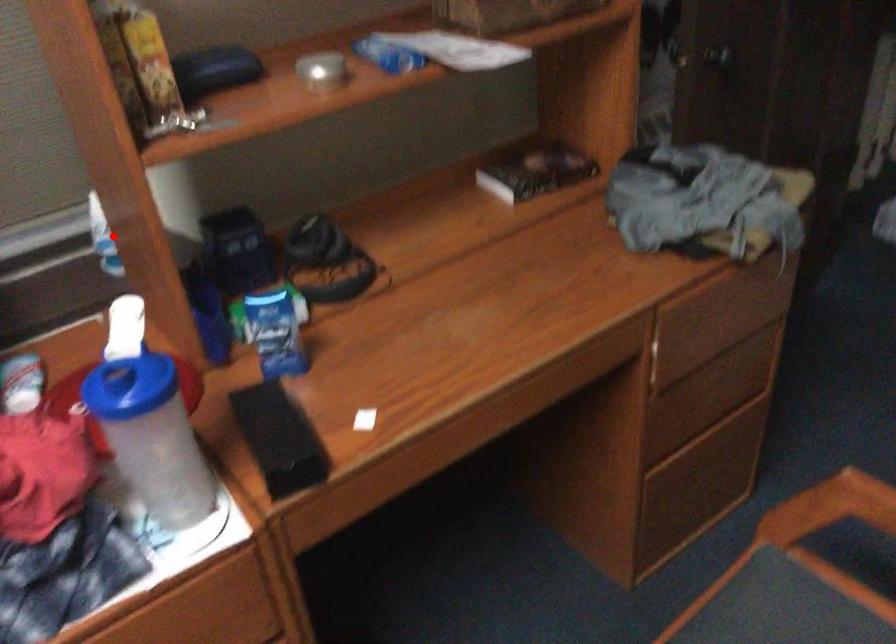
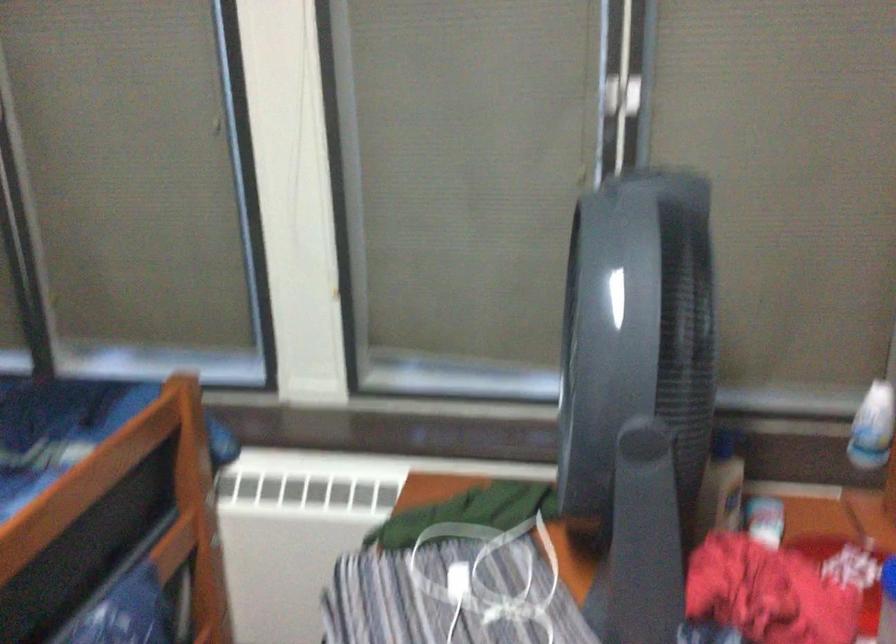
Find the pixel in the second image that matches the highlighted location in the first image.

(872, 427)